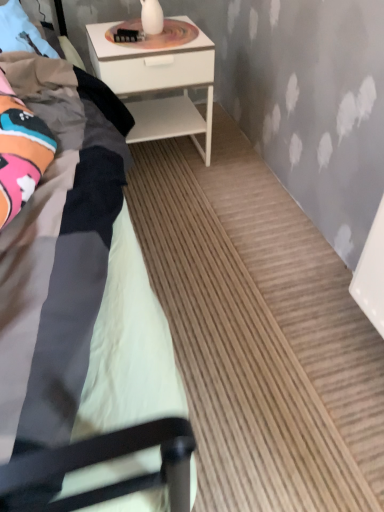
Where is `free space in front of white glossy nightstand at upper center`? The width and height of the screenshot is (384, 512). free space in front of white glossy nightstand at upper center is located at coordinates (180, 200).